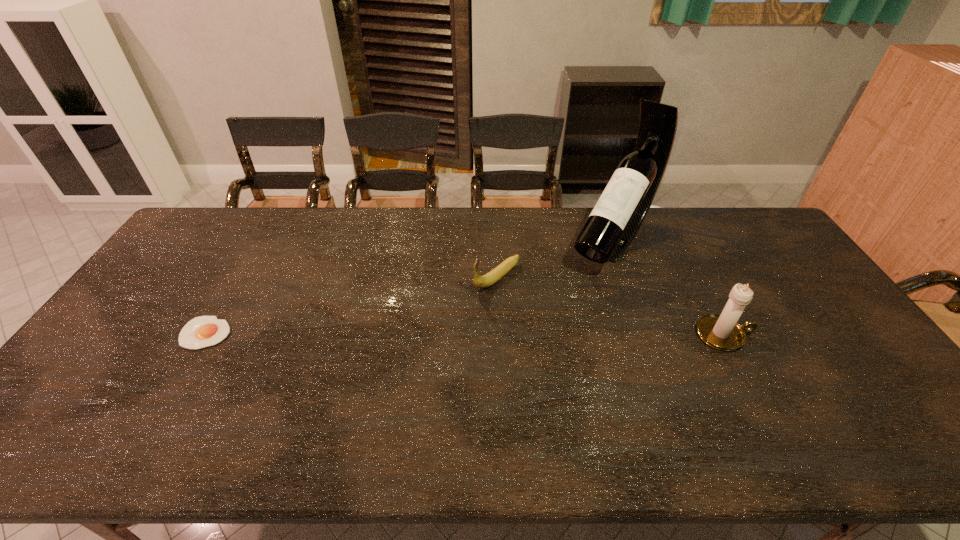
Where is `free space located 0.350m at the stem of the second object from left to right`? This screenshot has width=960, height=540. free space located 0.350m at the stem of the second object from left to right is located at coordinates (389, 357).

The width and height of the screenshot is (960, 540). What are the coordinates of `vacant space situated 0.400m on the stand of the tallest object` in the screenshot? It's located at (526, 354).

This screenshot has width=960, height=540. In order to click on vacant region located 0.130m on the stand of the tallest object in this screenshot , I will do `click(574, 296)`.

Where is `free region located on the stand of the tallest object`? The width and height of the screenshot is (960, 540). free region located on the stand of the tallest object is located at coordinates (554, 320).

Locate an element on the screen. object positioned at the far edge is located at coordinates (620, 211).

At what (x,y) coordinates should I click in order to perform the action: click on vacant space at the far edge of the desktop. Please return your answer as a coordinate pair (x, y). The width and height of the screenshot is (960, 540). Looking at the image, I should click on (436, 230).

Find the location of a particular element. vacant space at the near edge is located at coordinates (503, 391).

In the image, there is a desktop. Where is `vacant space at the left edge`? vacant space at the left edge is located at coordinates (123, 370).

This screenshot has width=960, height=540. In the image, there is a desktop. What are the coordinates of `vacant space at the right edge` in the screenshot? It's located at (771, 288).

Identify the location of free space at the far right corner of the desktop. (745, 222).